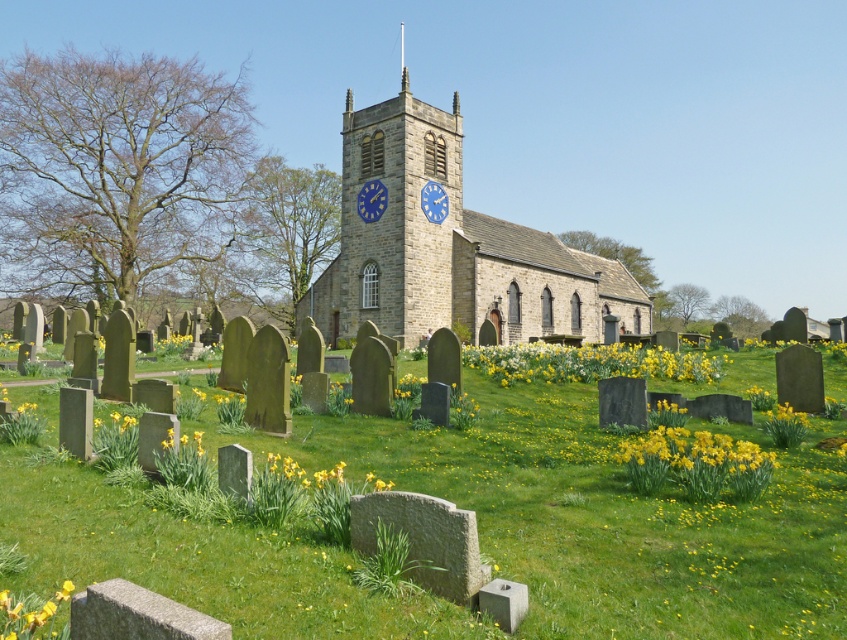
Does smooth stone tombstones at center have a lesser width compared to yellow matte flowers at center?

Incorrect, smooth stone tombstones at center's width is not less than yellow matte flowers at center's.

What do you see at coordinates (602, 515) in the screenshot? I see `smooth stone tombstones at center` at bounding box center [602, 515].

Is point (242, 444) in front of point (645, 358)?

Yes, point (242, 444) is closer to viewer.

The image size is (847, 640). Identify the location of smooth stone tombstones at center. (602, 515).

Does yellow matte flowers at center lie behind yellow matte flower at lower left?

Yes, yellow matte flowers at center is behind yellow matte flower at lower left.

Is point (626, 362) farther from camera compared to point (53, 602)?

That is True.

Where is `yellow matte flowers at center`? The width and height of the screenshot is (847, 640). yellow matte flowers at center is located at coordinates (591, 362).

What are the coordinates of `yellow matte flowers at center` in the screenshot? It's located at (591, 362).

Locate an element on the screen. smooth stone tombstones at center is located at coordinates (602, 515).

Does smooth stone tombstones at center appear on the left side of stone church at center?

Correct, you'll find smooth stone tombstones at center to the left of stone church at center.

At what (x,y) coordinates should I click in order to perform the action: click on smooth stone tombstones at center. Please return your answer as a coordinate pair (x, y). The width and height of the screenshot is (847, 640). Looking at the image, I should click on (602, 515).